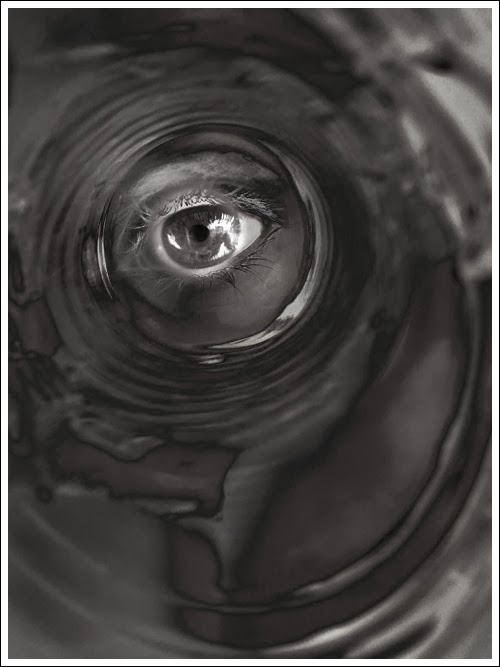
I want to click on glass, so click(273, 349), click(181, 79).